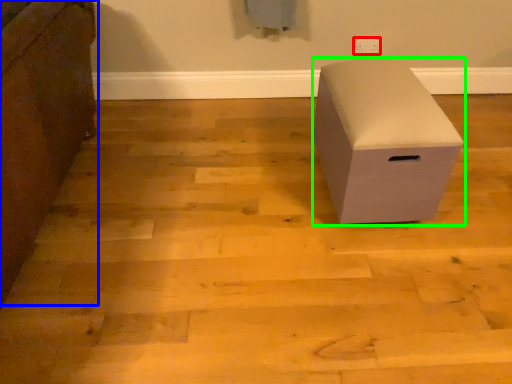
Question: Estimate the real-world distances between objects in this image. Which object is farther from electric outlet (highlighted by a red box), furniture (highlighted by a blue box) or furniture (highlighted by a green box)?

Choices:
 (A) furniture
 (B) furniture

Answer: (A)